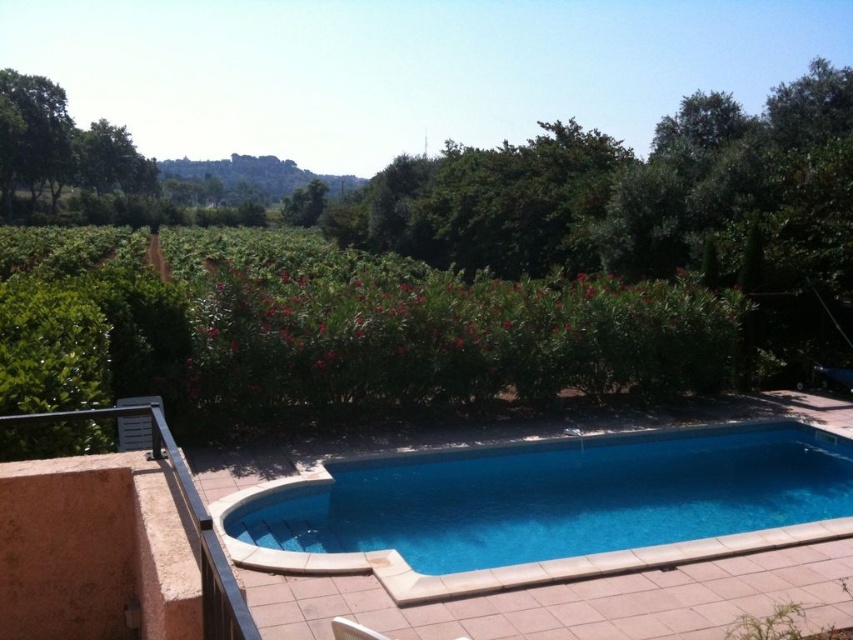
Does green leafy hedge at center lie in front of green leafy tree at upper left?

Yes, green leafy hedge at center is in front of green leafy tree at upper left.

Who is positioned more to the left, green leafy hedge at center or green leafy tree at upper left?

From the viewer's perspective, green leafy tree at upper left appears more on the left side.

Locate an element on the screen. This screenshot has width=853, height=640. green leafy hedge at center is located at coordinates (392, 336).

Where is `green leafy hedge at center`? The height and width of the screenshot is (640, 853). green leafy hedge at center is located at coordinates (392, 336).

What do you see at coordinates (61, 147) in the screenshot? I see `green leafy tree at upper left` at bounding box center [61, 147].

How much distance is there between green leafy tree at upper left and green leafy tree at upper center?

85.29 feet

Who is more forward, (103, 136) or (320, 186)?

Point (103, 136) is more forward.

You are a GUI agent. You are given a task and a screenshot of the screen. Output one action in this format:
    pyautogui.click(x=<x>, y=<y>)
    Task: Click on the green leafy tree at upper left
    The height and width of the screenshot is (640, 853).
    Given the screenshot: What is the action you would take?
    pyautogui.click(x=61, y=147)

Is blue smooth pool at center behind green leafy tree at upper left?

No, blue smooth pool at center is in front of green leafy tree at upper left.

Does blue smooth pool at center have a greater width compared to green leafy tree at upper left?

No, blue smooth pool at center is not wider than green leafy tree at upper left.

Which is in front, point (550, 472) or point (3, 166)?

Point (550, 472) is more forward.

Locate an element on the screen. The width and height of the screenshot is (853, 640). blue smooth pool at center is located at coordinates (550, 506).